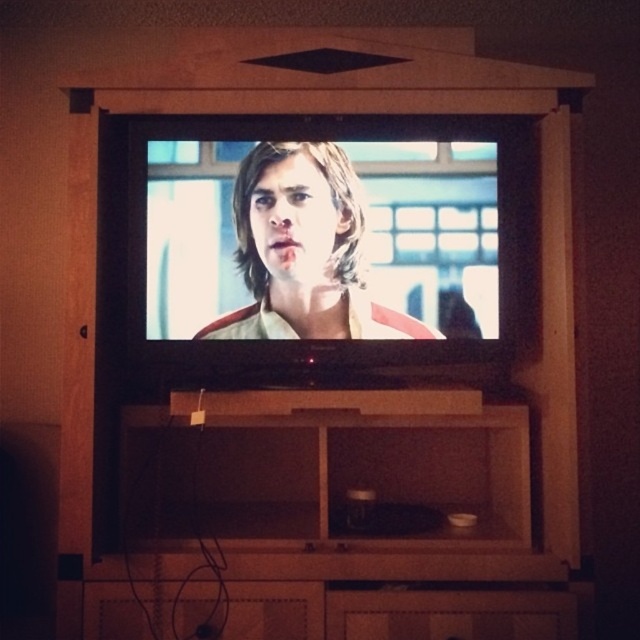
You are a delivery person who needs to place a package between the matte black shirt at center and the matte wood drawer at lower center. The package is 20 inches long. Can you fit it in the space between them without tilting?

The distance between the matte black shirt at center and the matte wood drawer at lower center is 23.02 inches. Since the package is 20 inches long, it can fit in the space between them without tilting.

You are standing in front of the TV and see the matte black shirt at center and the matte wood drawer at lower center. Which object is closer to your left side?

The matte black shirt at center is to the left of the matte wood drawer at lower center, so it is closer to your left side.